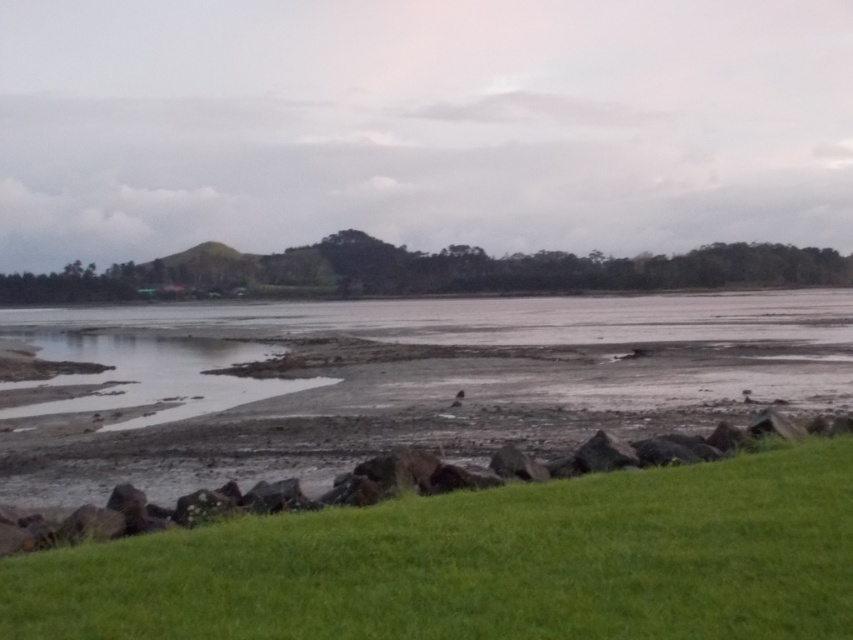
You are standing at the center of the image and want to walk towards the green grassy at lower right. Which direction should you move in?

The green grassy at lower right is located at point 0.883 on the x axis and 0.567 on the y axis. Since you are at the center, you should move towards the lower right direction to reach it.

From the picture: You are planning to set up a picnic area and have two options for locations in the image. One is the green grassy at lower right and the other is the muddy wetland at lower left. Considering the height of the vegetation, which location would be better for a picnic spot?

The green grassy at lower right is not as tall as the muddy wetland at lower left, so the green grassy at lower right would be better for a picnic spot as shorter vegetation is easier to set up on.